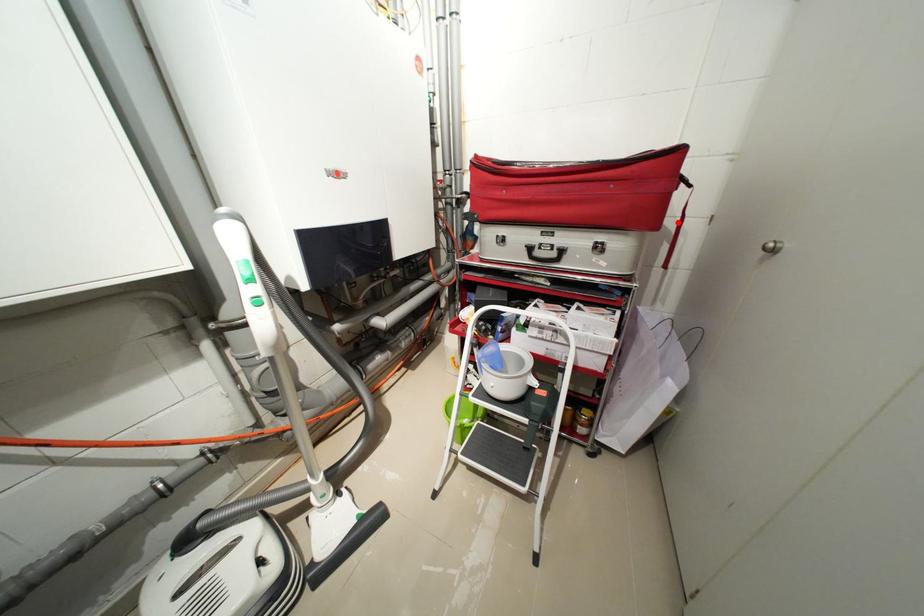
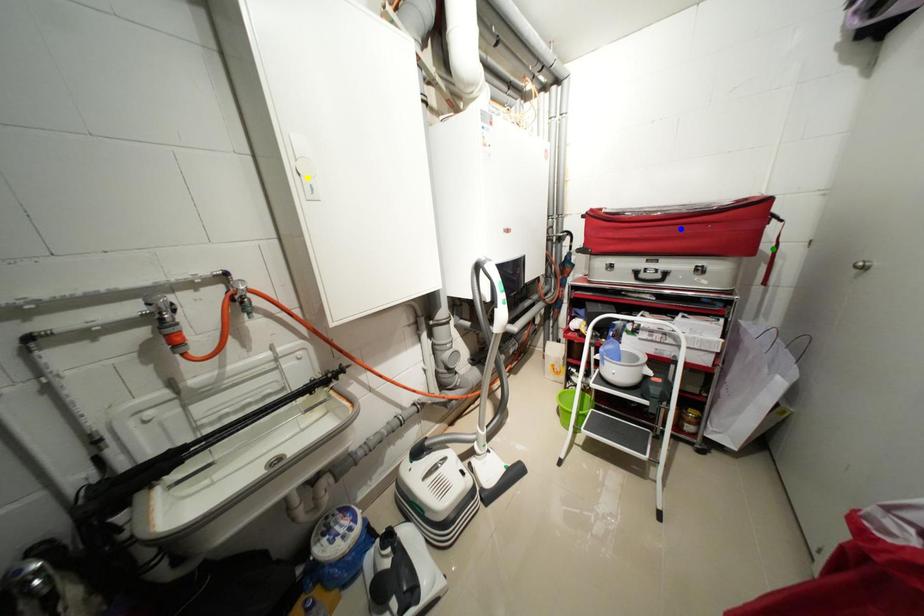
Question: I am providing you with two images of the same scene from different viewpoints. A red point is marked on the first image. You are given multiple points on the second image. In image 2, which mark is for the same physical point as the one in image 1?

Choices:
 (A) yellow point
 (B) blue point
 (C) green point

Answer: (C)